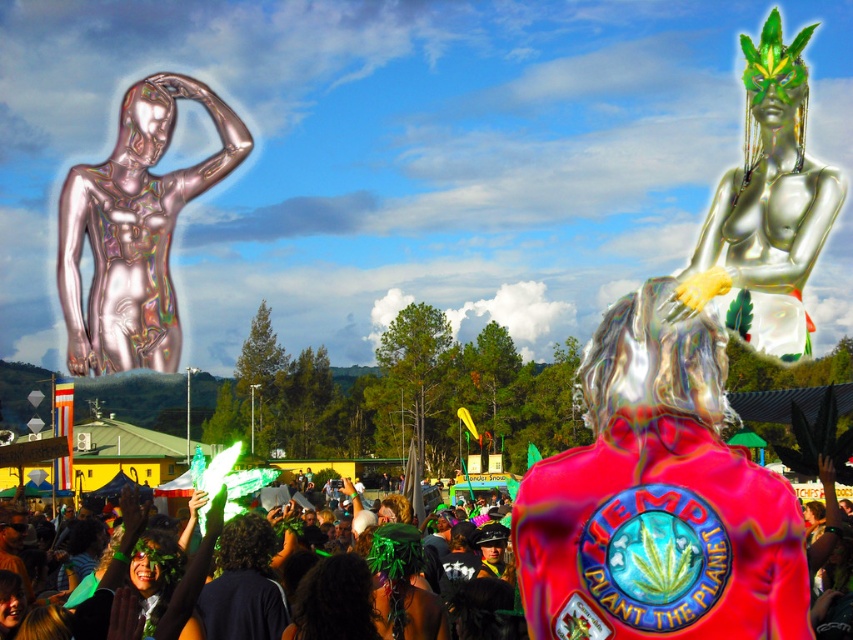
Is point (695, 612) positioned before point (152, 74)?

Yes, point (695, 612) is closer to viewer.

Does metallic silver jacket at center have a smaller size compared to holographic metallic statue at upper left?

Correct, metallic silver jacket at center occupies less space than holographic metallic statue at upper left.

Find the location of a particular element. This screenshot has height=640, width=853. metallic silver jacket at center is located at coordinates click(x=659, y=499).

Is silver metallic figure at upper right to the left of metallic green leaf at lower left from the viewer's perspective?

Incorrect, silver metallic figure at upper right is not on the left side of metallic green leaf at lower left.

Between point (753, 218) and point (103, 605), which one is positioned behind?

The point (753, 218) is more distant.

Identify the location of silver metallic figure at upper right. pos(767,209).

Who is lower down, metallic silver jacket at center or silver metallic figure at upper right?

Positioned lower is metallic silver jacket at center.

In the scene shown: Who is more forward, (x=793, y=540) or (x=693, y=280)?

Point (x=793, y=540)

The width and height of the screenshot is (853, 640). What do you see at coordinates (659, 499) in the screenshot?
I see `metallic silver jacket at center` at bounding box center [659, 499].

Find the location of a particular element. The height and width of the screenshot is (640, 853). metallic silver jacket at center is located at coordinates (659, 499).